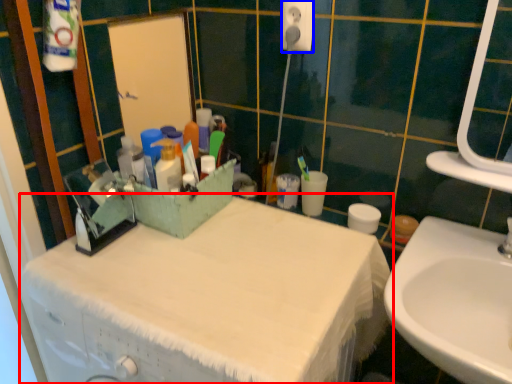
Question: Which object is closer to the camera taking this photo, bathroom cabinet (highlighted by a red box) or electric outlet (highlighted by a blue box)?

Choices:
 (A) bathroom cabinet
 (B) electric outlet

Answer: (A)